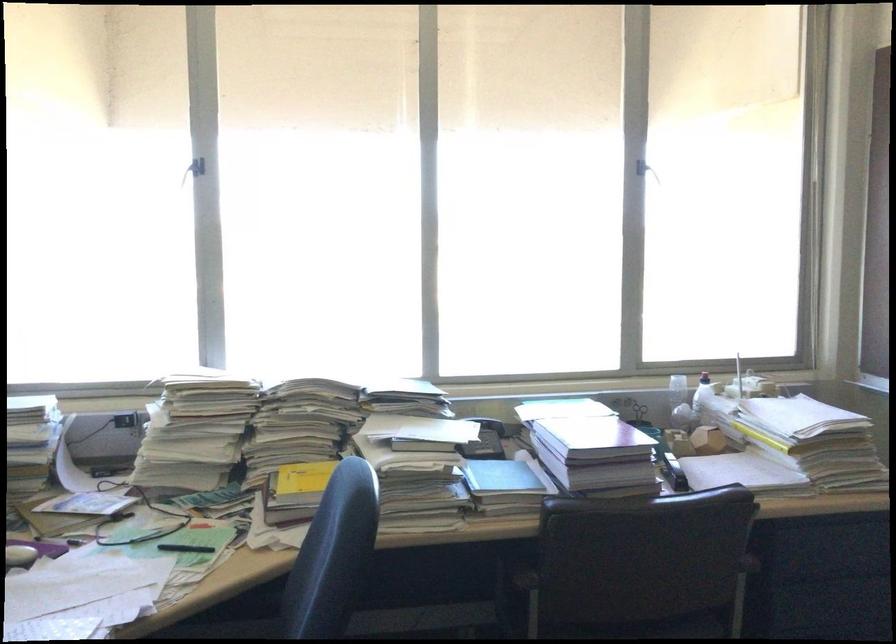
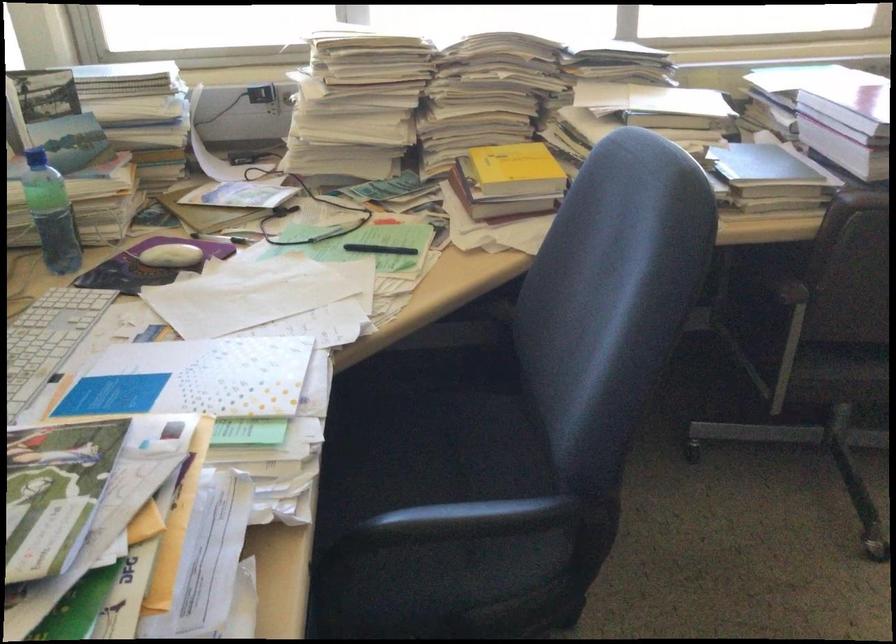
Based on the photo, in a continuous first-person perspective shot, in which direction is the camera moving?

The cameraman walked toward left, forward.